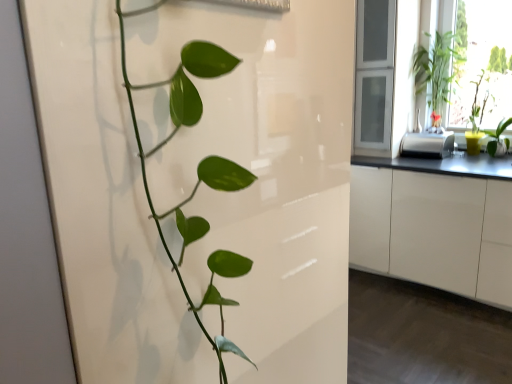
Identify the location of satin silver toaster at right. pos(426,144).

The width and height of the screenshot is (512, 384). In order to click on green glossy plant at left, the 1th houseplant positioned from the left in this screenshot , I will do `click(197, 172)`.

What are the coordinates of `green leafy plant at upper right` in the screenshot? It's located at (483, 61).

At what (x,y) coordinates should I click in order to perform the action: click on yellow matte pot at right, which appears as the 3th houseplant when viewed from the front. Please return your answer as a coordinate pair (x, y). The width and height of the screenshot is (512, 384). Looking at the image, I should click on (486, 88).

Locate an element on the screen. The image size is (512, 384). clear glass window frame at upper right is located at coordinates (374, 76).

From the picture: In order to face white glossy cabinetry at right, should I rotate leftwards or rightwards?

Turn right approximately 22.843 degrees to face it.

Describe the element at coordinates (436, 72) in the screenshot. This screenshot has height=384, width=512. I see `green glossy plant at upper right, positioned as the first houseplant in back-to-front order` at that location.

This screenshot has height=384, width=512. Identify the location of green glossy plant at upper right, the 3th houseplant from the right. (436, 72).

Locate an element on the screen. Image resolution: width=512 pixels, height=384 pixels. satin silver toaster at right is located at coordinates (426, 144).

Considering the sizes of objects green glossy plant at right, which is the 2th houseplant from front to back, and green glossy plant at left, arranged as the fourth houseplant when viewed from the right, in the image provided, who is thinner, green glossy plant at right, which is the 2th houseplant from front to back, or green glossy plant at left, arranged as the fourth houseplant when viewed from the right,?

green glossy plant at left, arranged as the fourth houseplant when viewed from the right, is thinner.

Is green glossy plant at left, arranged as the fourth houseplant when viewed from the right, surrounded by green glossy plant at right, positioned as the 3th houseplant in back-to-front order?

No, green glossy plant at left, arranged as the fourth houseplant when viewed from the right, is located outside of green glossy plant at right, positioned as the 3th houseplant in back-to-front order.

Is green glossy plant at right, marked as the 4th houseplant in a left-to-right arrangement, smaller than green glossy plant at left, acting as the 1th houseplant starting from the front?

Correct, green glossy plant at right, marked as the 4th houseplant in a left-to-right arrangement, occupies less space than green glossy plant at left, acting as the 1th houseplant starting from the front.

Can you confirm if satin silver toaster at right is taller than white glossy cabinetry at right?

No, satin silver toaster at right is not taller than white glossy cabinetry at right.

From a real-world perspective, does satin silver toaster at right sit lower than white glossy cabinetry at right?

No, from a real-world perspective, satin silver toaster at right is not beneath white glossy cabinetry at right.

Does satin silver toaster at right have a lesser width compared to white glossy cabinetry at right?

Yes, satin silver toaster at right is thinner than white glossy cabinetry at right.

Are green leafy plant at upper right and green glossy plant at right, the 1th houseplant from the right, far apart?

No, green leafy plant at upper right is not far away from green glossy plant at right, the 1th houseplant from the right.

From the image's perspective, between green leafy plant at upper right and green glossy plant at right, the 1th houseplant from the right, which one is located above?

From the image's view, green leafy plant at upper right is above.

Which is behind, point (474, 37) or point (492, 149)?

The point (474, 37) is behind.

Considering the sizes of green leafy plant at upper right and green glossy plant at right, marked as the 4th houseplant in a left-to-right arrangement, in the image, is green leafy plant at upper right bigger or smaller than green glossy plant at right, marked as the 4th houseplant in a left-to-right arrangement,?

green leafy plant at upper right is bigger than green glossy plant at right, marked as the 4th houseplant in a left-to-right arrangement.

Is yellow matte pot at right, marked as the 2th houseplant in a back-to-front arrangement, next to green glossy plant at upper right, the 3th houseplant from the right?

There is a gap between yellow matte pot at right, marked as the 2th houseplant in a back-to-front arrangement, and green glossy plant at upper right, the 3th houseplant from the right.

Is yellow matte pot at right, which appears as the 3th houseplant when viewed from the front, smaller than green glossy plant at upper right, positioned as the first houseplant in back-to-front order?

Yes.

From the image's perspective, is green glossy plant at right, which is the 2th houseplant from front to back, located beneath green leafy plant at upper right?

Yes, from the image's perspective, green glossy plant at right, which is the 2th houseplant from front to back, is beneath green leafy plant at upper right.

Is green glossy plant at right, which is the 2th houseplant from front to back, positioned with its back to green leafy plant at upper right?

Correct, green glossy plant at right, which is the 2th houseplant from front to back, is looking away from green leafy plant at upper right.

Is green glossy plant at right, positioned as the 3th houseplant in back-to-front order, taller than green leafy plant at upper right?

No.

In the scene shown: Considering the relative positions of green glossy plant at right, marked as the 4th houseplant in a left-to-right arrangement, and green leafy plant at upper right in the image provided, is green glossy plant at right, marked as the 4th houseplant in a left-to-right arrangement, to the left or to the right of green leafy plant at upper right?

In the image, green glossy plant at right, marked as the 4th houseplant in a left-to-right arrangement, appears on the right side of green leafy plant at upper right.

Where is `houseplant on the left side of satin silver toaster at right`? This screenshot has width=512, height=384. houseplant on the left side of satin silver toaster at right is located at coordinates (197, 172).

Between green glossy plant at left, acting as the 1th houseplant starting from the front, and satin silver toaster at right, which one has larger width?

satin silver toaster at right is wider.

From the image's perspective, which one is positioned lower, green glossy plant at left, arranged as the fourth houseplant when viewed from the right, or satin silver toaster at right?

green glossy plant at left, arranged as the fourth houseplant when viewed from the right, is shown below in the image.

Is green glossy plant at left, acting as the 4th houseplant starting from the back, bigger than satin silver toaster at right?

Actually, green glossy plant at left, acting as the 4th houseplant starting from the back, might be smaller than satin silver toaster at right.

Is satin silver toaster at right facing away from green glossy plant at upper right, positioned as the first houseplant in back-to-front order?

That's not correct — satin silver toaster at right is not looking away from green glossy plant at upper right, positioned as the first houseplant in back-to-front order.

Would you say satin silver toaster at right is to the left or to the right of green glossy plant at upper right, the 4th houseplant in the front-to-back sequence, in the picture?

satin silver toaster at right is to the left of green glossy plant at upper right, the 4th houseplant in the front-to-back sequence.

Is satin silver toaster at right surrounding green glossy plant at upper right, positioned as the first houseplant in back-to-front order?

That's incorrect, green glossy plant at upper right, positioned as the first houseplant in back-to-front order, is not inside satin silver toaster at right.

Where is `appliance located on the left of green glossy plant at upper right, the 3th houseplant from the right`? The image size is (512, 384). appliance located on the left of green glossy plant at upper right, the 3th houseplant from the right is located at coordinates (426, 144).

Where is `houseplant in front of the green glossy plant at right, marked as the 4th houseplant in a left-to-right arrangement`? houseplant in front of the green glossy plant at right, marked as the 4th houseplant in a left-to-right arrangement is located at coordinates (197, 172).

The image size is (512, 384). Find the location of `cabinetry located below the satin silver toaster at right (from the image's perspective)`. cabinetry located below the satin silver toaster at right (from the image's perspective) is located at coordinates (434, 231).

Based on their spatial positions, is white glossy cabinetry at right or green glossy plant at right, which is the 2th houseplant from front to back, further from yellow matte pot at right, marked as the 2th houseplant in a back-to-front arrangement?

Among the two, white glossy cabinetry at right is located further to yellow matte pot at right, marked as the 2th houseplant in a back-to-front arrangement.

Which object lies further to the anchor point green leafy plant at upper right, green glossy plant at upper right, the 2th houseplant positioned from the left, or yellow matte pot at right, which appears as the 3th houseplant when viewed from the front?

green glossy plant at upper right, the 2th houseplant positioned from the left, is positioned further to the anchor green leafy plant at upper right.

In the scene shown: Considering their positions, is green glossy plant at left, the 1th houseplant positioned from the left, positioned closer to yellow matte pot at right, which ranks as the 2th houseplant in right-to-left order, than satin silver toaster at right?

Among the two, satin silver toaster at right is located nearer to yellow matte pot at right, which ranks as the 2th houseplant in right-to-left order.

From the image, which object appears to be farther from yellow matte pot at right, acting as the 3th houseplant starting from the left, white glossy cabinetry at right or clear glass window frame at upper right?

white glossy cabinetry at right is positioned further to the anchor yellow matte pot at right, acting as the 3th houseplant starting from the left.

Looking at the image, which one is located further to satin silver toaster at right, green glossy plant at left, arranged as the fourth houseplant when viewed from the right, or green glossy plant at right, the 1th houseplant from the right?

The object further to satin silver toaster at right is green glossy plant at left, arranged as the fourth houseplant when viewed from the right.

Which object lies further to the anchor point satin silver toaster at right, yellow matte pot at right, which ranks as the 2th houseplant in right-to-left order, or green glossy plant at upper right, the 4th houseplant in the front-to-back sequence?

green glossy plant at upper right, the 4th houseplant in the front-to-back sequence, is further to satin silver toaster at right.

When comparing their distances from green glossy plant at right, marked as the 4th houseplant in a left-to-right arrangement, does green leafy plant at upper right or satin silver toaster at right seem further?

Based on the image, green leafy plant at upper right appears to be further to green glossy plant at right, marked as the 4th houseplant in a left-to-right arrangement.

Based on their spatial positions, is green glossy plant at left, acting as the 1th houseplant starting from the front, or white glossy cabinetry at right further from yellow matte pot at right, which ranks as the 2th houseplant in right-to-left order?

green glossy plant at left, acting as the 1th houseplant starting from the front, lies further to yellow matte pot at right, which ranks as the 2th houseplant in right-to-left order, than the other object.

This screenshot has width=512, height=384. Identify the location of cabinetry located between green glossy plant at left, acting as the 4th houseplant starting from the back, and yellow matte pot at right, which appears as the 3th houseplant when viewed from the front, in the depth direction. (434, 231).

This screenshot has height=384, width=512. I want to click on window frame between green glossy plant at left, the 1th houseplant positioned from the left, and satin silver toaster at right from front to back, so click(374, 76).

Find the location of `window screen between green glossy plant at left, the 1th houseplant positioned from the left, and yellow matte pot at right, which ranks as the 2th houseplant in right-to-left order, along the z-axis`. window screen between green glossy plant at left, the 1th houseplant positioned from the left, and yellow matte pot at right, which ranks as the 2th houseplant in right-to-left order, along the z-axis is located at coordinates (483, 61).

You are a GUI agent. You are given a task and a screenshot of the screen. Output one action in this format:
    pyautogui.click(x=<x>, y=<y>)
    Task: Click on the cabinetry between green glossy plant at left, acting as the 4th houseplant starting from the back, and green glossy plant at upper right, the 4th houseplant in the front-to-back sequence, along the z-axis
    
    Given the screenshot: What is the action you would take?
    pyautogui.click(x=434, y=231)